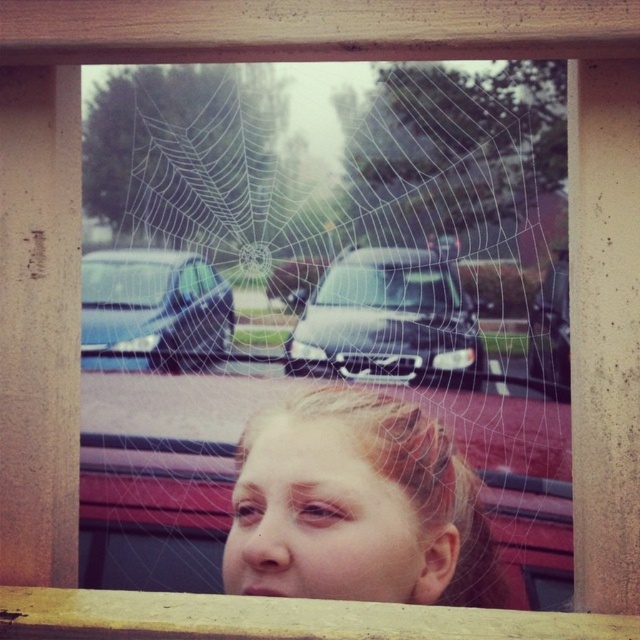
In order to click on smooth skin face at center in this screenshot , I will do `click(356, 508)`.

Which is in front, point (417, 477) or point (113, 259)?

Point (417, 477) is more forward.

Is point (244, 481) in front of point (161, 253)?

Yes.

Locate an element on the screen. This screenshot has width=640, height=640. smooth skin face at center is located at coordinates (356, 508).

Does smooth skin face at center have a smaller size compared to satin black car at center?

Incorrect, smooth skin face at center is not smaller in size than satin black car at center.

Which is more to the right, smooth skin face at center or satin black car at center?

From the viewer's perspective, satin black car at center appears more on the right side.

Is point (380, 524) closer to viewer compared to point (360, 269)?

That is True.

What are the coordinates of `smooth skin face at center` in the screenshot? It's located at (356, 508).

Between transparent glass spider web at center and smooth skin face at center, which one has more height?

transparent glass spider web at center is taller.

This screenshot has height=640, width=640. I want to click on transparent glass spider web at center, so click(x=323, y=304).

You are a GUI agent. You are given a task and a screenshot of the screen. Output one action in this format:
    pyautogui.click(x=<x>, y=<y>)
    Task: Click on the transparent glass spider web at center
    The width and height of the screenshot is (640, 640).
    Given the screenshot: What is the action you would take?
    pyautogui.click(x=323, y=304)

At what (x,y) coordinates should I click in order to perform the action: click on transparent glass spider web at center. Please return your answer as a coordinate pair (x, y). Looking at the image, I should click on (323, 304).